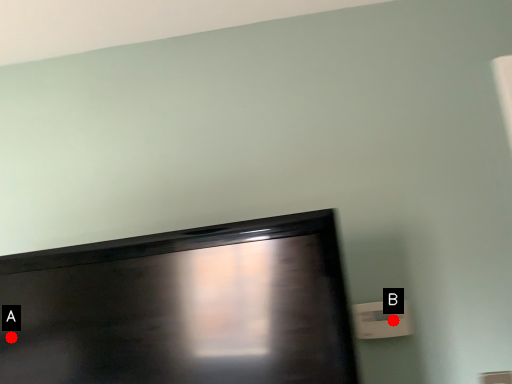
Question: Two points are circled on the image, labeled by A and B beside each circle. Among these points, which one is nearest to the camera?

Choices:
 (A) A is closer
 (B) B is closer

Answer: (A)